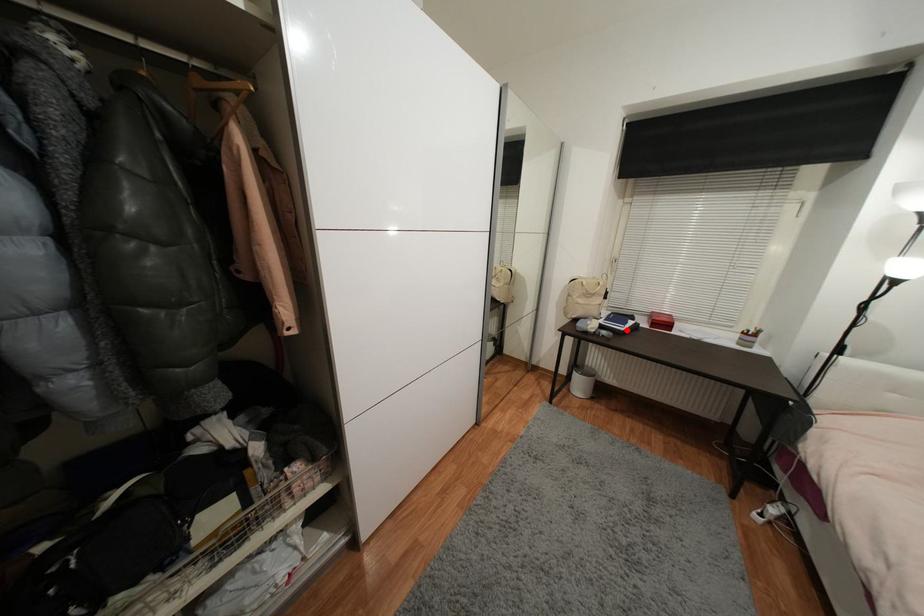
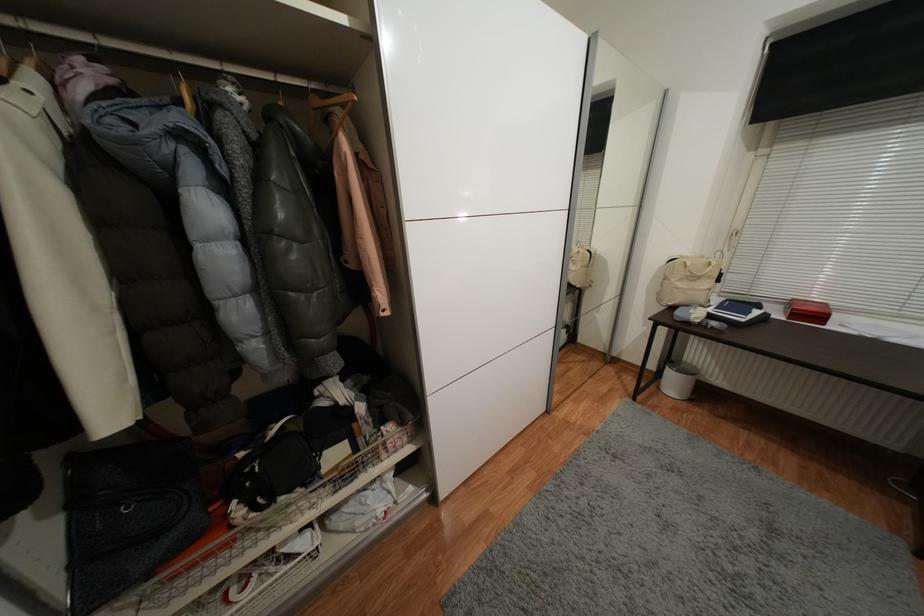
In the second image, find the point that corresponds to the highlighted location in the first image.

(747, 321)